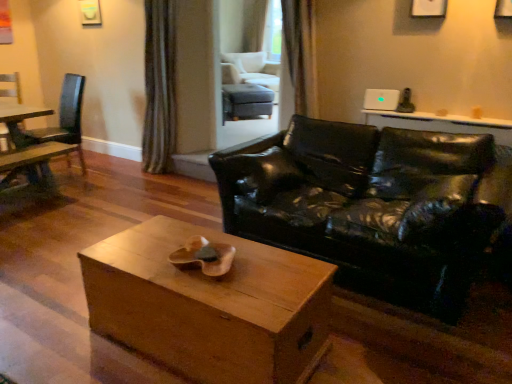
Where is `vacant area located to the right-hand side of wooden bench at left`? Image resolution: width=512 pixels, height=384 pixels. vacant area located to the right-hand side of wooden bench at left is located at coordinates (98, 208).